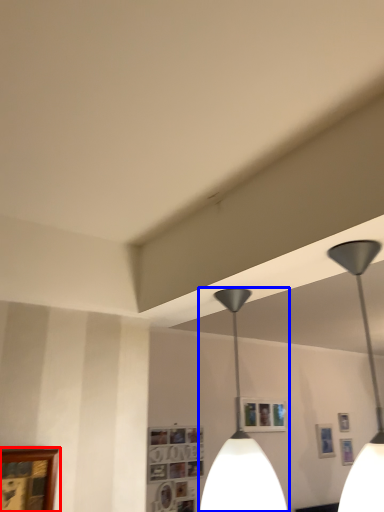
Question: Which of the following is the closest to the observer, picture frame (highlighted by a red box) or lamp (highlighted by a blue box)?

Choices:
 (A) picture frame
 (B) lamp

Answer: (B)